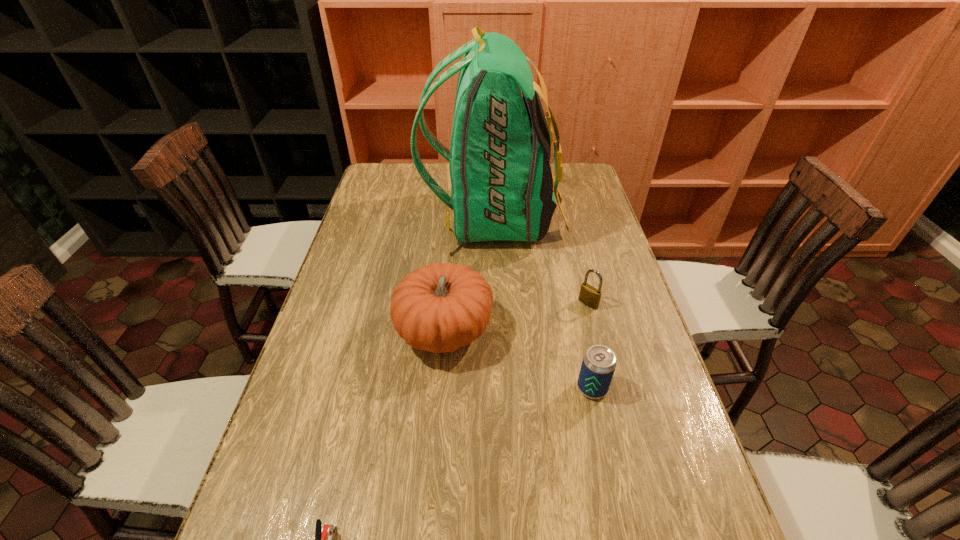
At what (x,y) coordinates should I click in order to perform the action: click on the farthest object. Please return your answer as a coordinate pair (x, y). Looking at the image, I should click on (501, 181).

In order to click on the tallest object in this screenshot , I will do `click(501, 181)`.

You are a GUI agent. You are given a task and a screenshot of the screen. Output one action in this format:
    pyautogui.click(x=<x>, y=<y>)
    Task: Click on the second tallest object
    The height and width of the screenshot is (540, 960).
    Given the screenshot: What is the action you would take?
    pyautogui.click(x=439, y=308)

I want to click on padlock, so [590, 296].

Where is `beer can`? The height and width of the screenshot is (540, 960). beer can is located at coordinates (599, 362).

Locate an element on the screen. vacant space situated 0.150m on the back of the backpack is located at coordinates (381, 218).

I want to click on vacant region located on the back of the backpack, so coord(390,218).

Locate an element on the screen. This screenshot has height=540, width=960. vacant region located on the back of the backpack is located at coordinates (372, 218).

Image resolution: width=960 pixels, height=540 pixels. Identify the location of vacant space located on the left of the second tallest object. (322, 332).

Locate an element on the screen. free space located 0.070m on the left of the padlock is located at coordinates (554, 303).